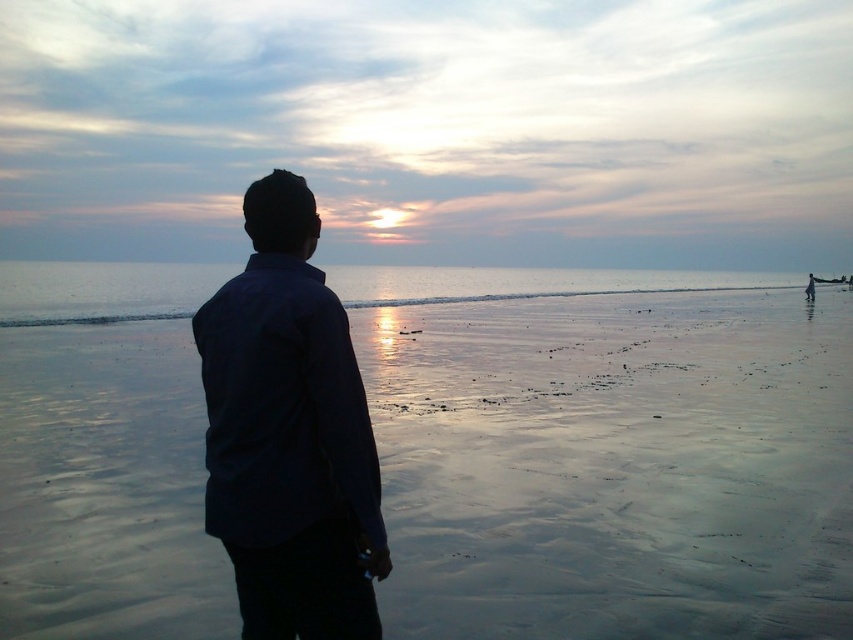
You are standing at the point marked as point (x=766, y=611) on the beach. You want to walk straight towards the horizon where the sun is setting. How far will you have to walk before you reach the water?

The distance between you and the water cannot be determined from the given information.

You are planning to build a sandcastle on the beach. You have a bucket that can hold 2 liters of sand. Considering the size of the smooth sand at center and the dark blue shirt at center, which object would you use to measure the sand needed for the sandcastle?

The smooth sand at center has a larger size compared to the dark blue shirt at center, so you should use the smooth sand at center to measure the sand needed for the sandcastle since it has a larger volume.

Consider the image. You are a photographer trying to capture the sunset. You notice the dark blue shirt at center and the glistening silver water at center in your frame. Which object takes up more space horizontally in the image?

The glistening silver water at center takes up more space horizontally compared to the dark blue shirt at center since it has a greater width.